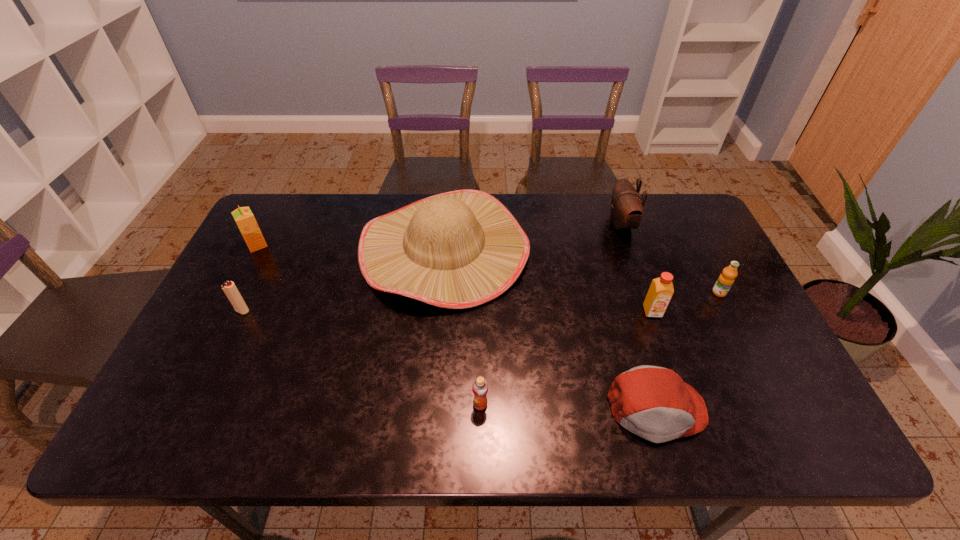
At what (x,y) coordinates should I click in order to perform the action: click on free space located 0.280m with the flap open on the pouch. Please return your answer as a coordinate pair (x, y). Image resolution: width=960 pixels, height=540 pixels. Looking at the image, I should click on (521, 225).

Where is `vacant space located 0.350m with the flap open on the pouch`? The image size is (960, 540). vacant space located 0.350m with the flap open on the pouch is located at coordinates (500, 225).

Find the location of a particular element. The height and width of the screenshot is (540, 960). free space located 0.380m with the flap open on the pouch is located at coordinates (492, 225).

Where is `vacant space located 0.340m on the front of the leftmost orange juice`? The width and height of the screenshot is (960, 540). vacant space located 0.340m on the front of the leftmost orange juice is located at coordinates (205, 344).

The image size is (960, 540). I want to click on free space located 0.070m on the front and back of the third orange juice from left to right, so click(662, 340).

The height and width of the screenshot is (540, 960). I want to click on free space located 0.050m on the label of the rightmost object, so click(729, 312).

The width and height of the screenshot is (960, 540). Find the location of `blank space located on the back of the igniter`. blank space located on the back of the igniter is located at coordinates (282, 229).

The width and height of the screenshot is (960, 540). Identify the location of vacant area situated on the back of the nearest orange juice. (480, 308).

Where is `sunhat that is at the far edge`? sunhat that is at the far edge is located at coordinates (460, 249).

Find the location of `pouch present at the far edge`. pouch present at the far edge is located at coordinates (626, 211).